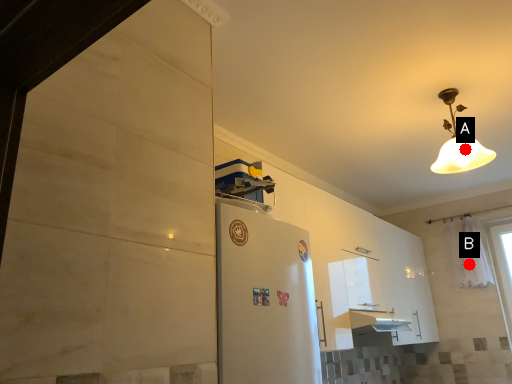
Question: Two points are circled on the image, labeled by A and B beside each circle. Which point is closer to the camera?

Choices:
 (A) A is closer
 (B) B is closer

Answer: (A)